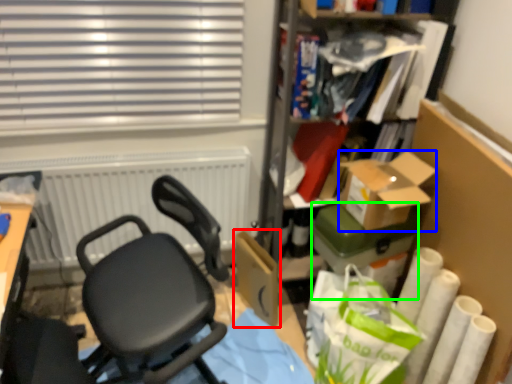
Question: Which object is the farthest from cardboard box (highlighted by a red box)? Choose among these: box (highlighted by a blue box) or box (highlighted by a green box).

Choices:
 (A) box
 (B) box

Answer: (A)